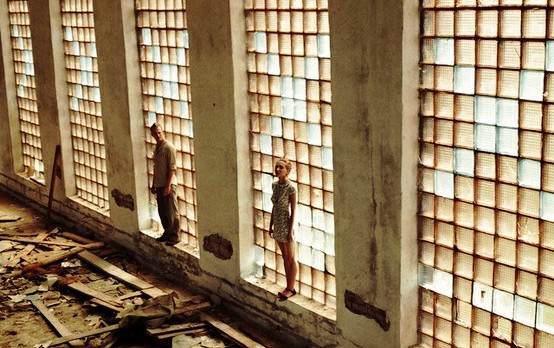
I want to click on pillar, so click(x=119, y=130).